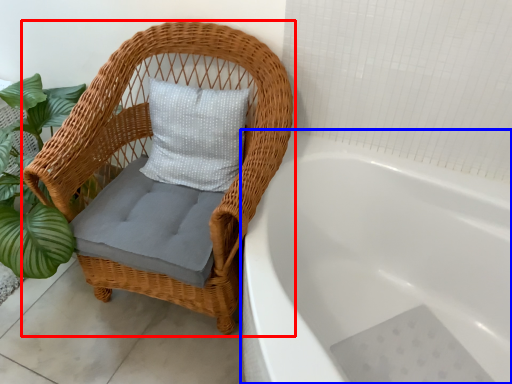
Question: Which of the following is the farthest to the observer, chair (highlighted by a red box) or bathtub (highlighted by a blue box)?

Choices:
 (A) chair
 (B) bathtub

Answer: (A)